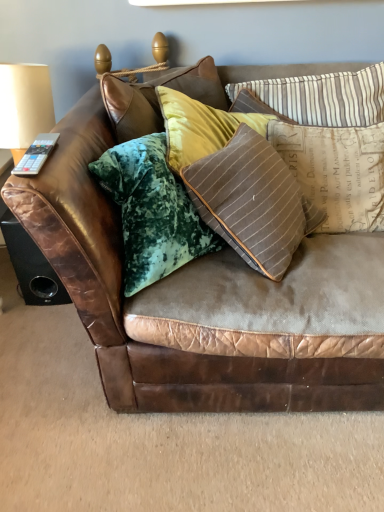
Question: Can you confirm if brown leather speaker at lower left is bigger than striped fabric pillow at upper right, placed as the first pillow when sorted from top to bottom?

Choices:
 (A) no
 (B) yes

Answer: (B)

Question: From a real-world perspective, is brown leather speaker at lower left located higher than striped fabric pillow at upper right, which appears as the second pillow when ordered from the bottom?

Choices:
 (A) yes
 (B) no

Answer: (B)

Question: Does brown leather speaker at lower left have a smaller size compared to striped fabric pillow at upper right, which appears as the second pillow when ordered from the bottom?

Choices:
 (A) yes
 (B) no

Answer: (B)

Question: Is brown leather speaker at lower left to the left of striped fabric pillow at upper right, which appears as the second pillow when ordered from the bottom, from the viewer's perspective?

Choices:
 (A) no
 (B) yes

Answer: (B)

Question: Is brown leather speaker at lower left closer to the viewer compared to striped fabric pillow at upper right, placed as the first pillow when sorted from top to bottom?

Choices:
 (A) yes
 (B) no

Answer: (B)

Question: Can you confirm if brown leather speaker at lower left is positioned to the right of striped fabric pillow at upper right, which appears as the second pillow when ordered from the bottom?

Choices:
 (A) yes
 (B) no

Answer: (B)

Question: Can you confirm if matte beige lampshade at upper left is bigger than brown leather couch at center?

Choices:
 (A) no
 (B) yes

Answer: (A)

Question: Does matte beige lampshade at upper left have a greater height compared to brown leather couch at center?

Choices:
 (A) no
 (B) yes

Answer: (A)

Question: Can you confirm if matte beige lampshade at upper left is wider than brown leather couch at center?

Choices:
 (A) no
 (B) yes

Answer: (A)

Question: Could you tell me if matte beige lampshade at upper left is facing brown leather couch at center?

Choices:
 (A) no
 (B) yes

Answer: (A)

Question: Is matte beige lampshade at upper left positioned behind brown leather couch at center?

Choices:
 (A) yes
 (B) no

Answer: (A)

Question: Does matte beige lampshade at upper left have a lesser width compared to brown leather couch at center?

Choices:
 (A) yes
 (B) no

Answer: (A)

Question: Is brown striped pillow at upper right, positioned as the first pillow in bottom-to-top order, to the right of brown leather speaker at lower left from the viewer's perspective?

Choices:
 (A) no
 (B) yes

Answer: (B)